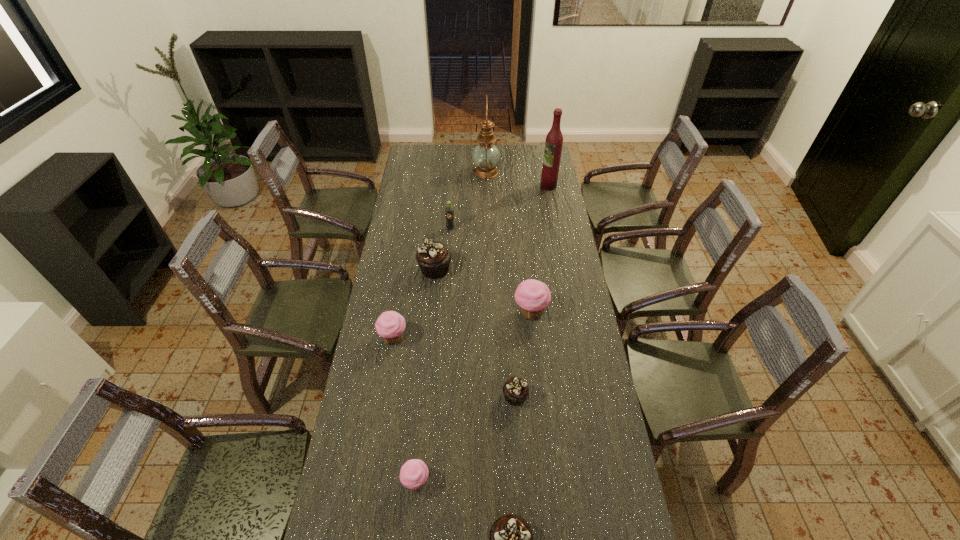
Locate an element on the screen. The height and width of the screenshot is (540, 960). the leftmost object is located at coordinates click(390, 325).

Find the location of a particular element. The image size is (960, 540). the second farthest brown cupcake is located at coordinates (515, 390).

The height and width of the screenshot is (540, 960). What are the coordinates of `the third nearest cupcake` in the screenshot? It's located at (515, 390).

Locate an element on the screen. This screenshot has width=960, height=540. the second nearest cupcake is located at coordinates (413, 474).

You are a GUI agent. You are given a task and a screenshot of the screen. Output one action in this format:
    pyautogui.click(x=<x>, y=<y>)
    Task: Click on the second pink cupcake from right to left
    Image resolution: width=960 pixels, height=540 pixels.
    Given the screenshot: What is the action you would take?
    pyautogui.click(x=413, y=474)

Find the location of a particular element. This screenshot has width=960, height=540. free spot located 0.340m on the label of the dark liquor is located at coordinates (475, 186).

At what (x,y) coordinates should I click in order to perform the action: click on vacant space located on the label of the dark liquor. Please return your answer as a coordinate pair (x, y). This screenshot has height=540, width=960. Looking at the image, I should click on (529, 186).

Locate an element on the screen. vacant space located on the label of the dark liquor is located at coordinates (469, 186).

At what (x,y) coordinates should I click in order to perform the action: click on vacant position located 0.360m on the left of the oil lamp. Please return your answer as a coordinate pair (x, y). Looking at the image, I should click on (406, 172).

At what (x,y) coordinates should I click in order to perform the action: click on free space located on the front label of the soda. Please return your answer as a coordinate pair (x, y). The width and height of the screenshot is (960, 540). Looking at the image, I should click on tap(447, 272).